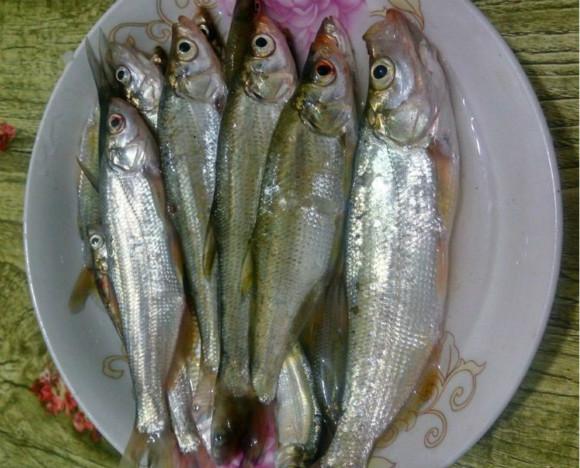
The image size is (580, 468). I want to click on plate, so click(x=499, y=232).